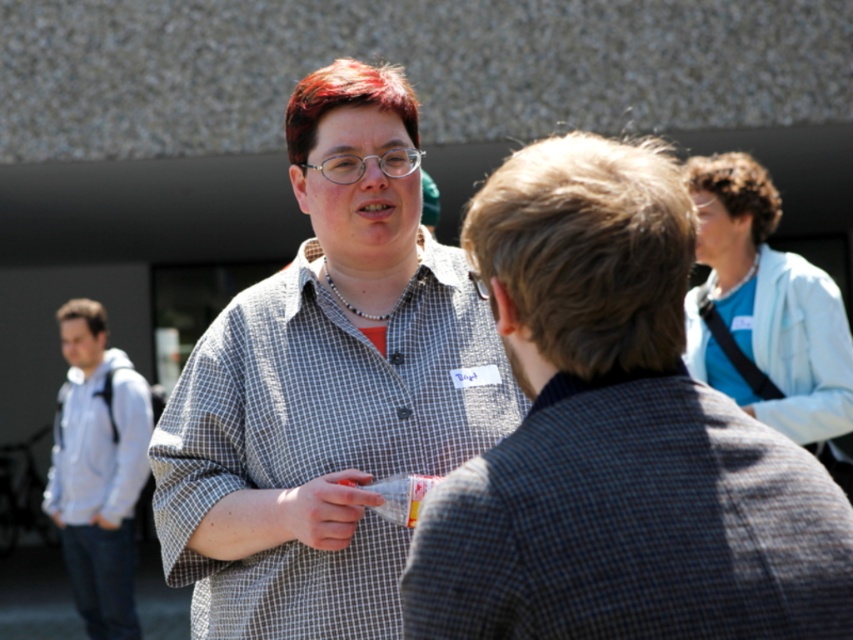
Question: Can you confirm if light blue fabric coat at right is thinner than clear plastic glasses at center?

Choices:
 (A) no
 (B) yes

Answer: (A)

Question: Which point is farther to the camera?

Choices:
 (A) (746, 257)
 (B) (219, 330)

Answer: (A)

Question: Can you confirm if checkered shirt at center is bigger than transparent plastic glasses at center?

Choices:
 (A) yes
 (B) no

Answer: (A)

Question: Does checkered fabric shirt at center lie behind transparent plastic glasses at center?

Choices:
 (A) yes
 (B) no

Answer: (B)

Question: Which is nearer to the clear plastic glasses at center?

Choices:
 (A) checkered shirt at center
 (B) checkered fabric shirt at center

Answer: (A)

Question: Estimate the real-world distances between objects in this image. Which object is closer to the gray hoodie at left?

Choices:
 (A) light blue fabric coat at right
 (B) clear plastic glasses at center
 (C) checkered fabric shirt at center

Answer: (A)